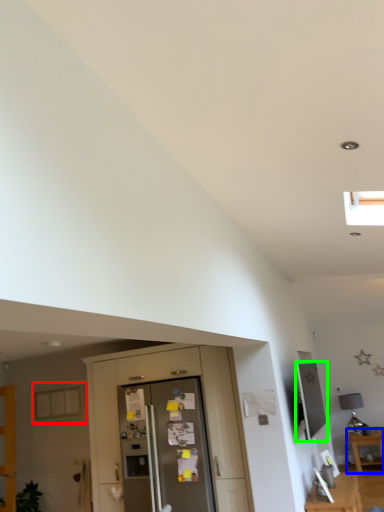
Question: Based on their relative distances, which object is farther from window (highlighted by a red box)? Choose from table (highlighted by a blue box) and appliance (highlighted by a green box).

Choices:
 (A) table
 (B) appliance

Answer: (A)